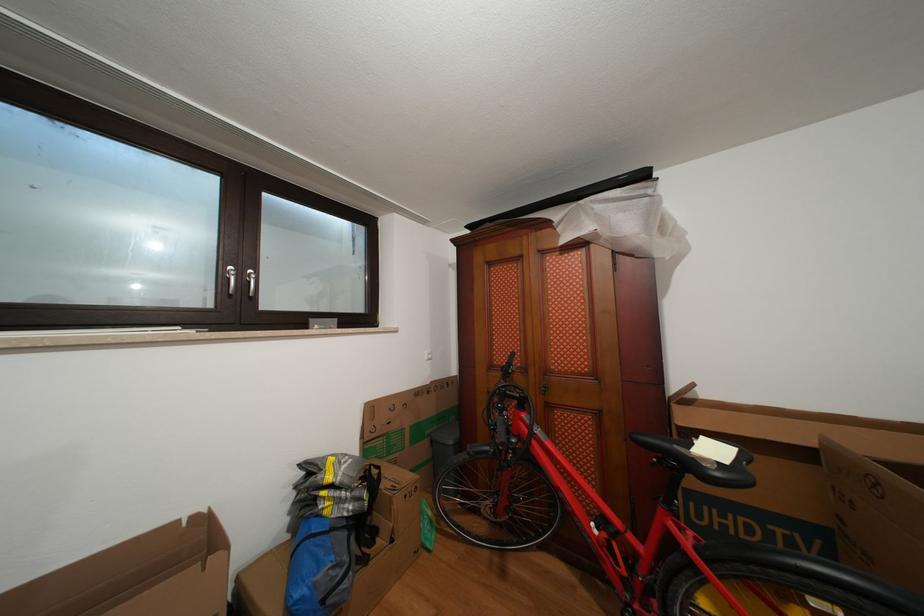
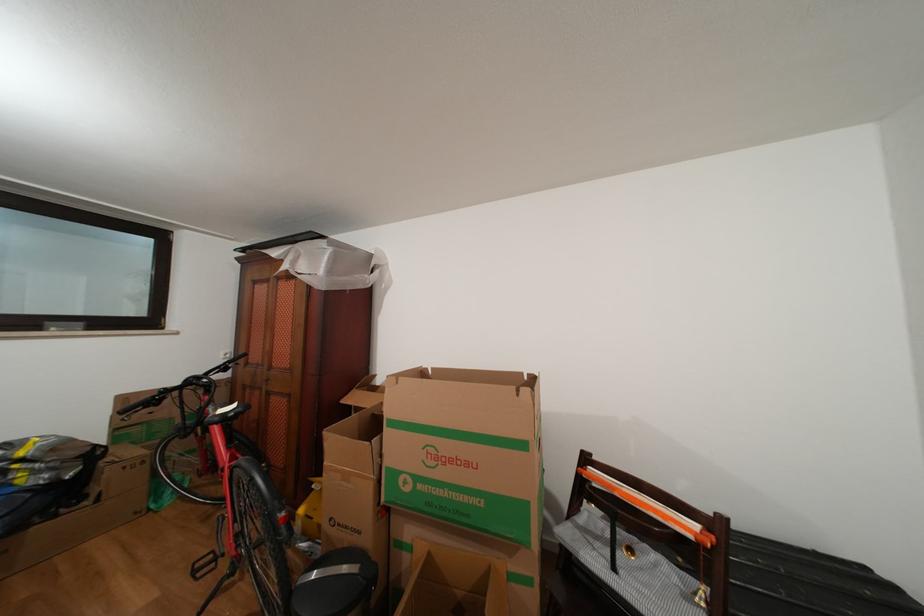
Where in the second image is the point corresponding to (x=320, y=326) from the first image?

(56, 329)